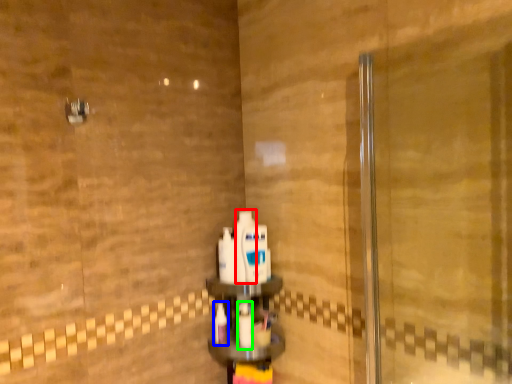
Question: Which is farther away from mouthwash (highlighted by a red box)? toothbrush (highlighted by a blue box) or mouthwash (highlighted by a green box)?

Choices:
 (A) toothbrush
 (B) mouthwash

Answer: (A)